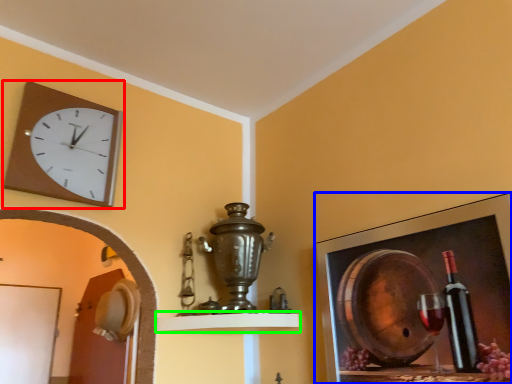
Question: Estimate the real-world distances between objects in this image. Which object is farther from wall clock (highlighted by a red box), picture frame (highlighted by a blue box) or shelf (highlighted by a green box)?

Choices:
 (A) picture frame
 (B) shelf

Answer: (A)